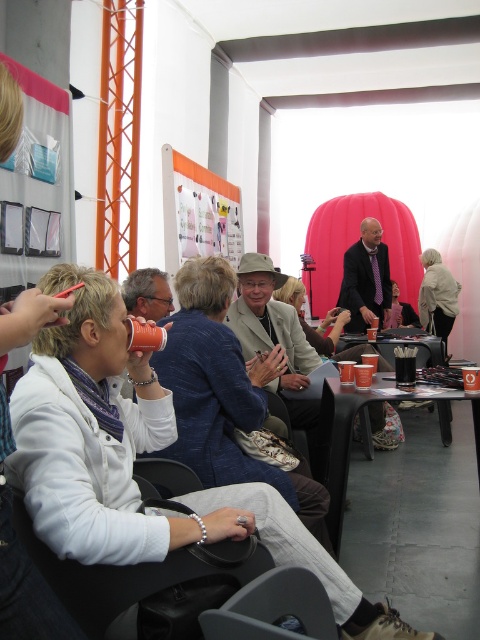
You are organizing a presentation and need to place both the matte black glasses at center and the black plastic cup at center on a shelf. If the shelf has limited vertical space, which item should you place first to ensure both fit?

The black plastic cup at center is shorter than the matte black glasses at center. To ensure both fit on the shelf with limited vertical space, place the taller matte black glasses at center first, then the shorter black plastic cup at center.

You are organizing a workshop and need to place a name tag on either the white fabric bag at right or the matte black jacket at center. Which object would you choose if you want the name tag to be more visible from a distance?

The white fabric bag at right is much taller than the matte black jacket at center, so placing the name tag on the white fabric bag at right would make it more visible from a distance.